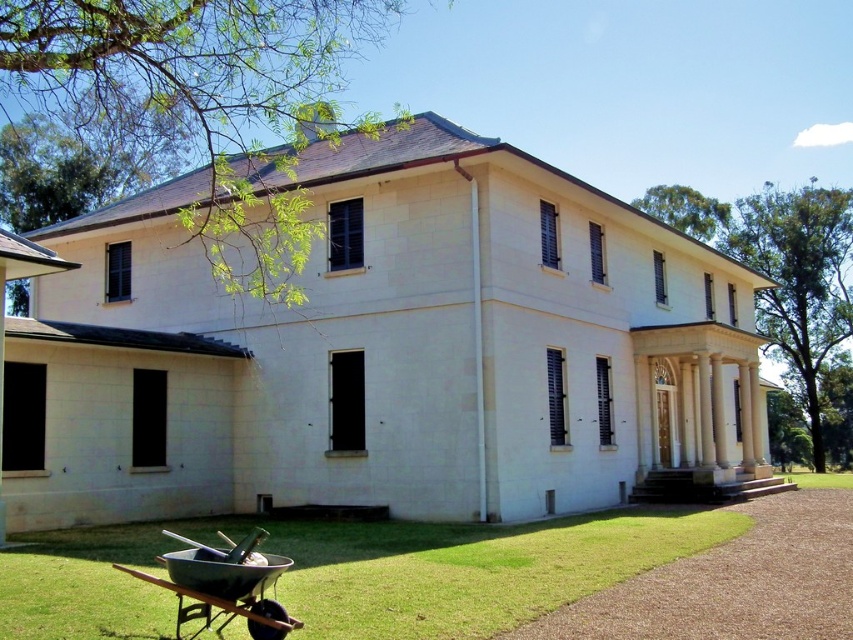
Which of these two, green grass at lower left or metallic wheelbarrow at lower left, stands shorter?

With less height is metallic wheelbarrow at lower left.

Can you confirm if green grass at lower left is wider than metallic wheelbarrow at lower left?

Indeed, green grass at lower left has a greater width compared to metallic wheelbarrow at lower left.

This screenshot has height=640, width=853. I want to click on green grass at lower left, so click(462, 566).